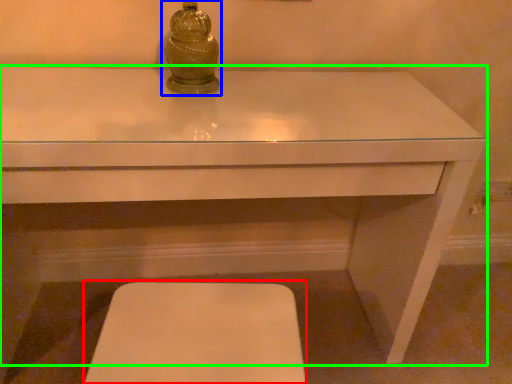
Question: Which object is positioned farthest from step stool (highlighted by a red box)? Select from candle holder (highlighted by a blue box) and table (highlighted by a green box).

Choices:
 (A) candle holder
 (B) table

Answer: (A)